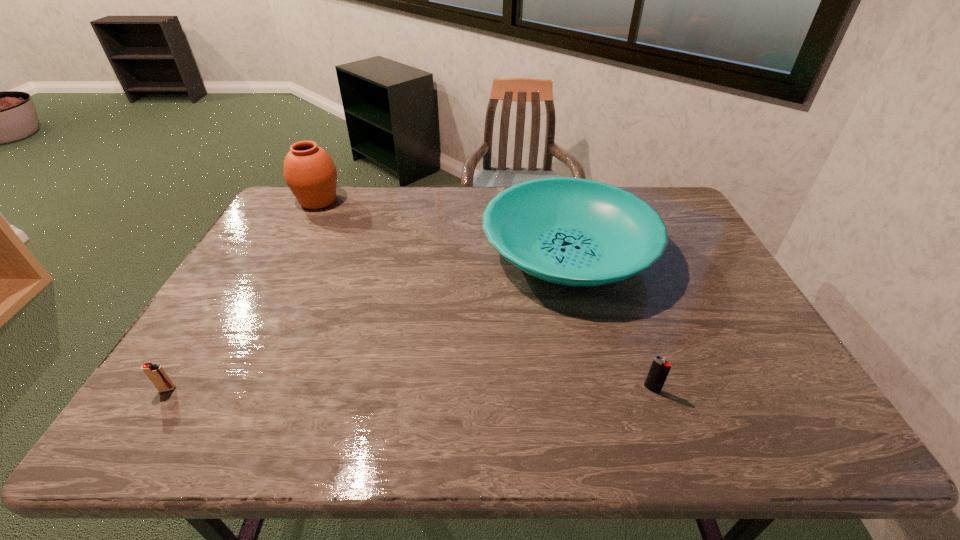
This screenshot has height=540, width=960. I want to click on urn, so click(x=309, y=171).

I want to click on the third object from right to left, so click(x=309, y=171).

Where is `dish`? dish is located at coordinates (571, 231).

Locate an element on the screen. the second shortest object is located at coordinates pyautogui.click(x=660, y=368).

Image resolution: width=960 pixels, height=540 pixels. I want to click on the right igniter, so click(x=660, y=368).

The height and width of the screenshot is (540, 960). In order to click on the leftmost object in this screenshot , I will do `click(157, 375)`.

The height and width of the screenshot is (540, 960). Identify the location of the shorter igniter. (157, 375).

Locate an element on the screen. The height and width of the screenshot is (540, 960). vacant space situated 0.290m on the right of the second object from left to right is located at coordinates click(x=421, y=201).

The height and width of the screenshot is (540, 960). I want to click on vacant space located 0.070m on the back of the dish, so click(x=554, y=198).

I want to click on vacant space situated 0.160m on the right of the right igniter, so click(x=729, y=389).